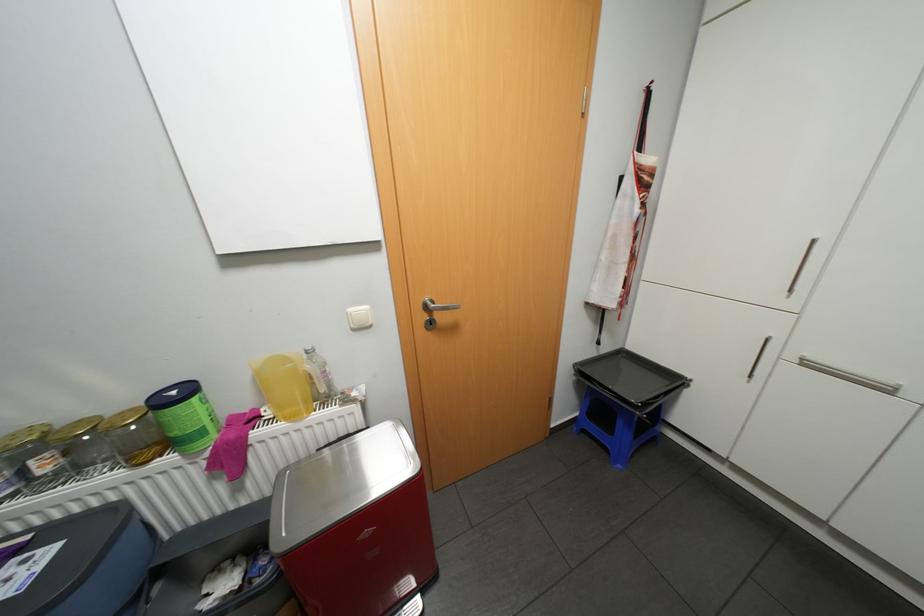
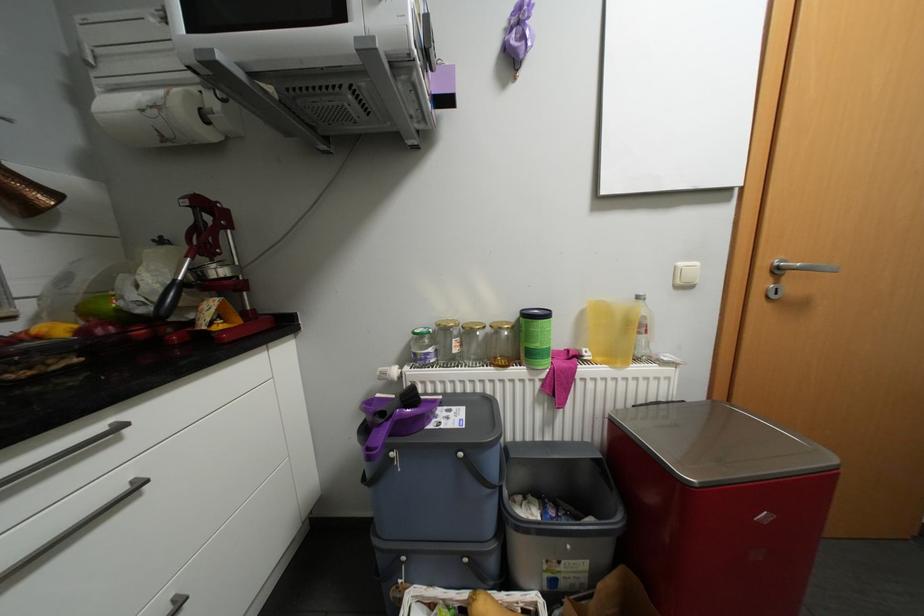
Question: The camera is either moving clockwise (left) or counter-clockwise (right) around the object. The first image is from the beginning of the video and the second image is from the end. Is the camera moving left or right when shooting the video?

Choices:
 (A) Left
 (B) Right

Answer: (B)